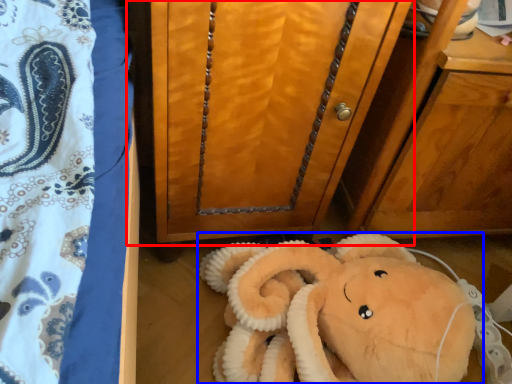
Question: Among these objects, which one is farthest to the camera, furniture (highlighted by a red box) or toy (highlighted by a blue box)?

Choices:
 (A) furniture
 (B) toy

Answer: (B)